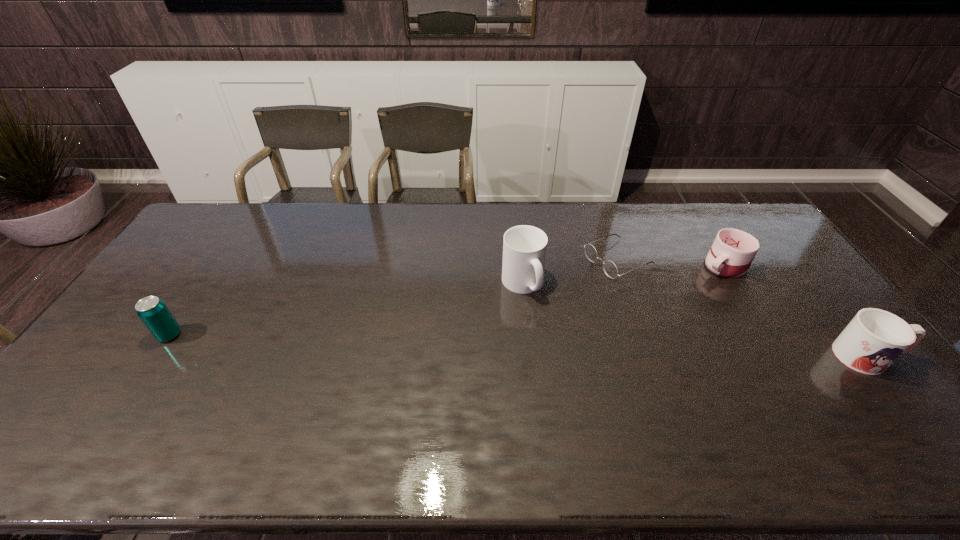
At what (x,y) coordinates should I click in order to perform the action: click on object present at the left edge. Please return your answer as a coordinate pair (x, y). The width and height of the screenshot is (960, 540). Looking at the image, I should click on (152, 311).

At what (x,y) coordinates should I click in order to perform the action: click on vacant space at the far edge of the desktop. Please return your answer as a coordinate pair (x, y). The image size is (960, 540). Looking at the image, I should click on (564, 213).

Locate an element on the screen. free spot at the near edge of the desktop is located at coordinates (727, 414).

Locate an element on the screen. vacant space at the far left corner is located at coordinates (241, 219).

Locate an element on the screen. vacant point located between the leftmost object and the second object from right to left is located at coordinates (447, 300).

Where is `vacant area between the shortest object and the tallest object`? This screenshot has width=960, height=540. vacant area between the shortest object and the tallest object is located at coordinates (570, 272).

This screenshot has width=960, height=540. Find the location of `blank region between the shortest object and the second object from left to right`. blank region between the shortest object and the second object from left to right is located at coordinates (570, 272).

Identify the location of vacant area between the spectacles and the beer can. (394, 298).

Locate an element on the screen. Image resolution: width=960 pixels, height=540 pixels. vacant space that is in between the beer can and the nearest mug is located at coordinates (518, 346).

Where is `vacant point located between the tallest mug and the leftmost object`? The height and width of the screenshot is (540, 960). vacant point located between the tallest mug and the leftmost object is located at coordinates (346, 309).